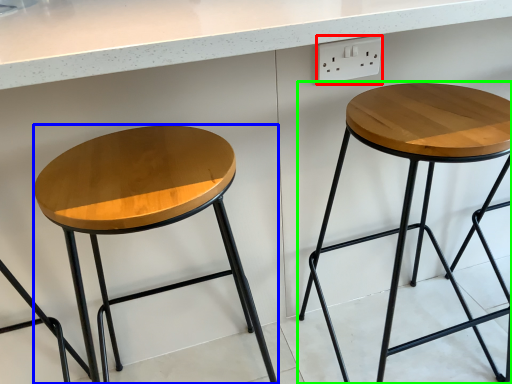
Question: Estimate the real-world distances between objects in this image. Which object is closer to electric outlet (highlighted by a red box), stool (highlighted by a blue box) or stool (highlighted by a green box)?

Choices:
 (A) stool
 (B) stool

Answer: (B)